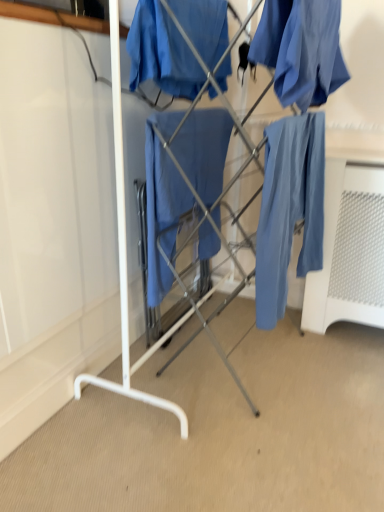
Image resolution: width=384 pixels, height=512 pixels. I want to click on free space in front of matte blue fabric at center, so click(x=243, y=438).